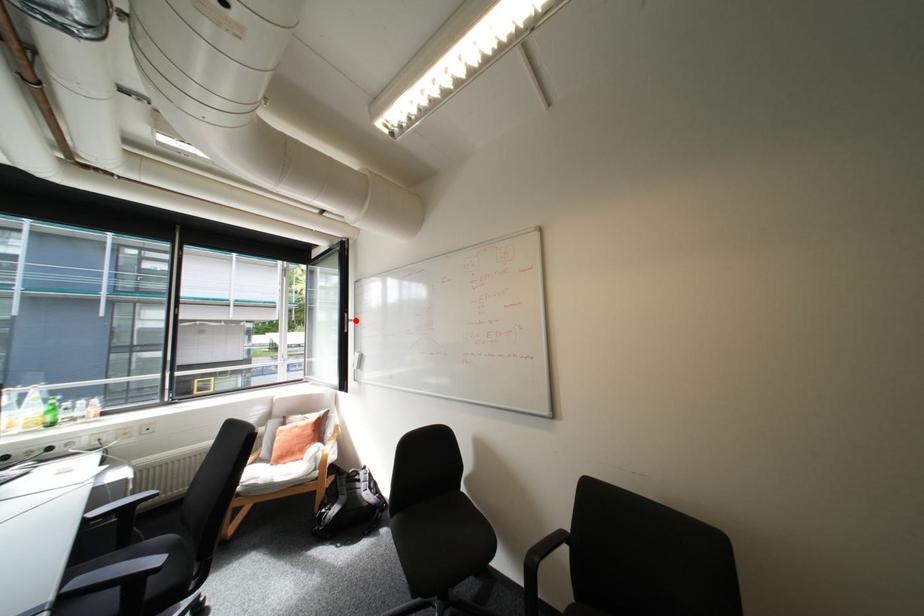
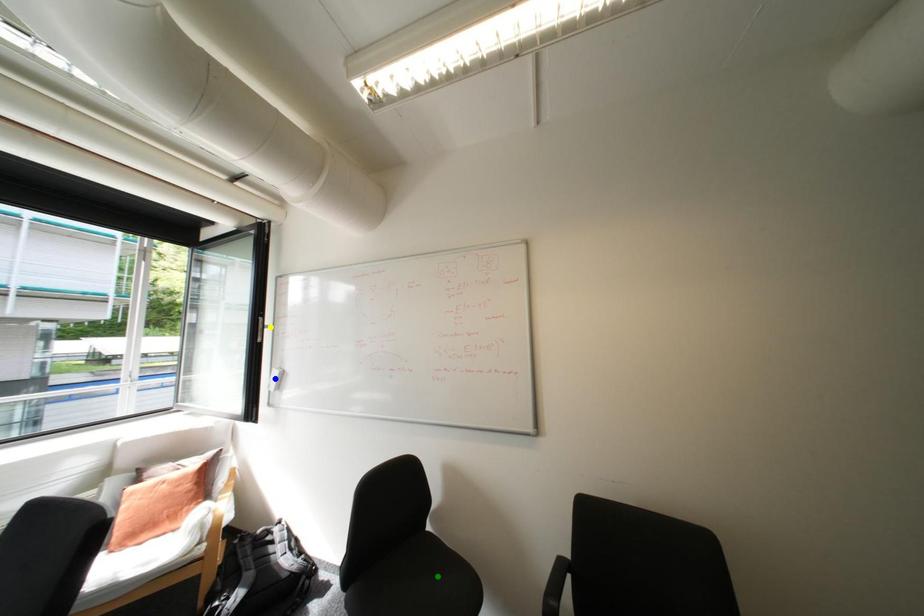
Question: I am providing you with two images of the same scene from different viewpoints. A red point is marked on the first image. You are given multiple points on the second image. Can you choose the point in image 2 that corresponds to the point in image 1?

Choices:
 (A) yellow point
 (B) green point
 (C) blue point

Answer: (A)